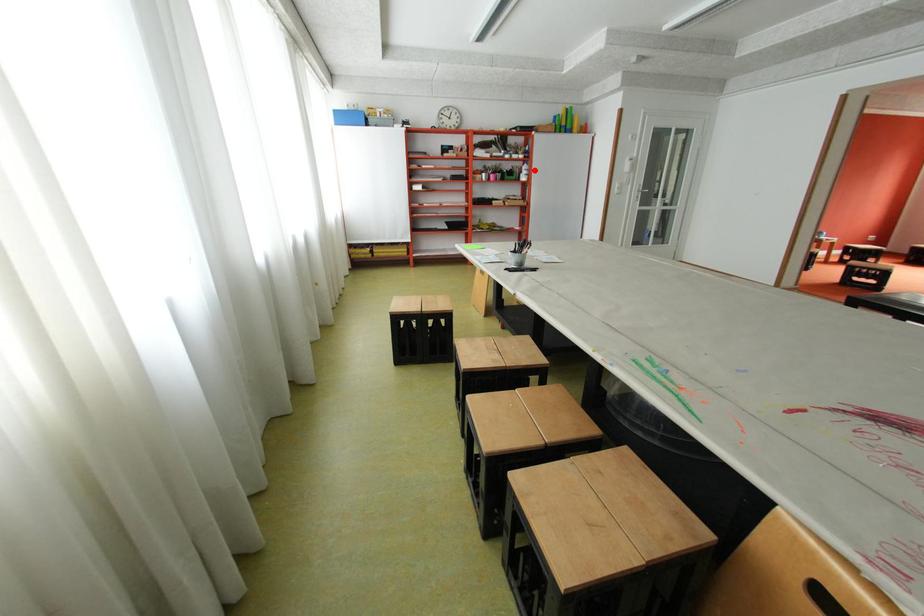
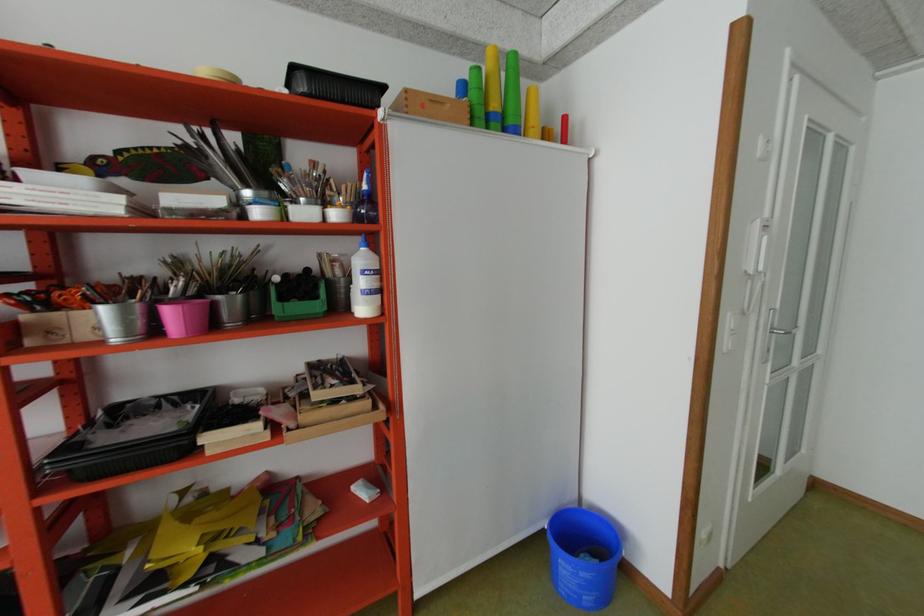
Question: I am providing you with two images of the same scene from different viewpoints. A red point is shown in image1. For the corresponding object point in image2, is it positioned nearer or farther from the camera?

Choices:
 (A) Nearer
 (B) Farther

Answer: (B)